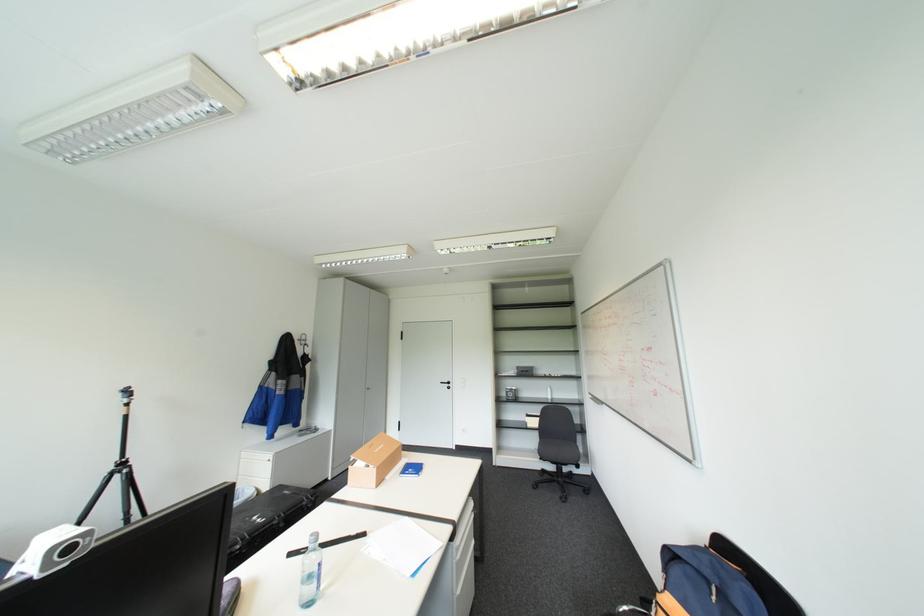
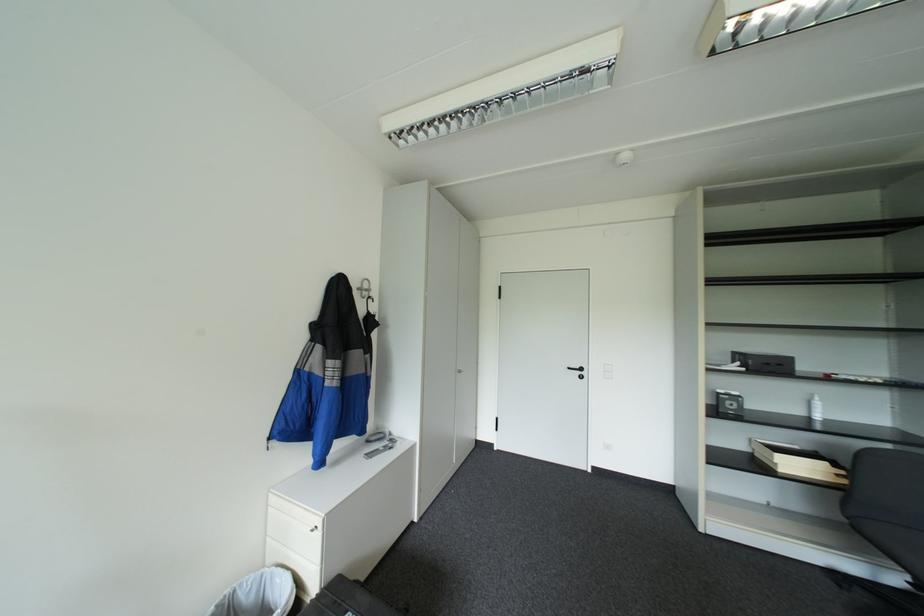
What movement of the cameraman would produce the second image?

The cameraman walked toward left, forward.